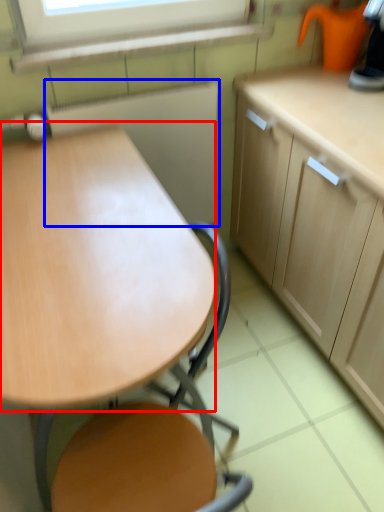
Question: Which object is closer to the camera taking this photo, round table (highlighted by a red box) or appliance (highlighted by a blue box)?

Choices:
 (A) round table
 (B) appliance

Answer: (A)